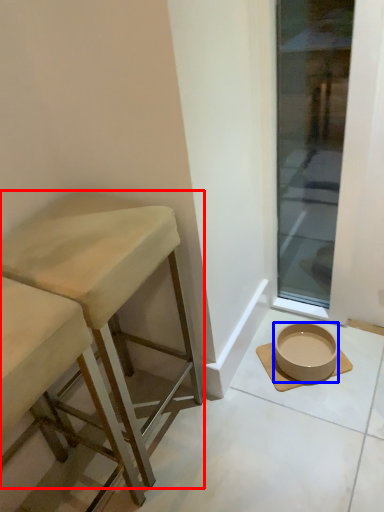
Question: Which of the following is the farthest to the observer, stool (highlighted by a red box) or bowl (highlighted by a blue box)?

Choices:
 (A) stool
 (B) bowl

Answer: (B)